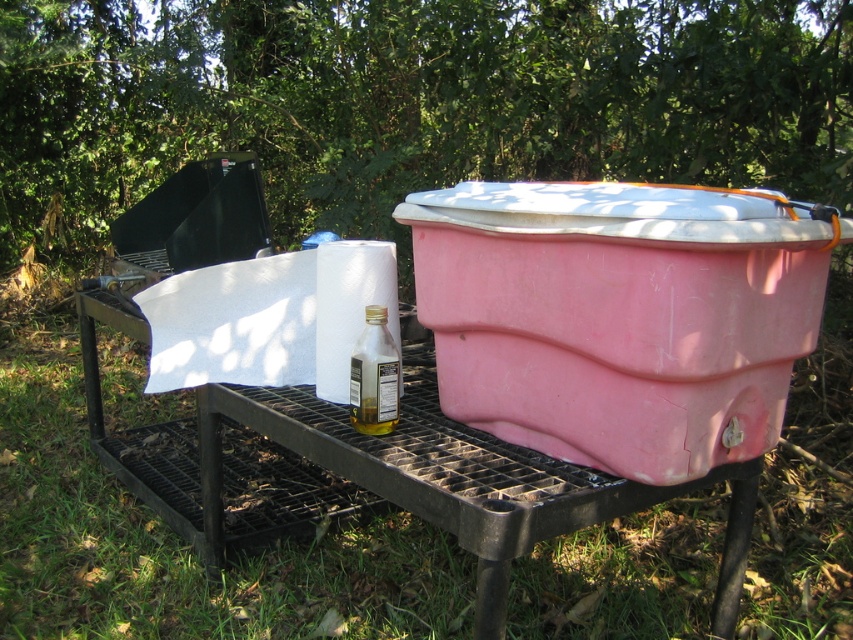
Question: Can you confirm if green grass at lower left is smaller than clear glass bottle at center?

Choices:
 (A) yes
 (B) no

Answer: (B)

Question: Is pink plastic cooler at center bigger than clear glass bottle at center?

Choices:
 (A) yes
 (B) no

Answer: (A)

Question: Is green grass at lower left above clear glass bottle at center?

Choices:
 (A) yes
 (B) no

Answer: (B)

Question: Which point appears farthest from the camera in this image?

Choices:
 (A) (376, 330)
 (B) (538, 282)

Answer: (A)

Question: Which point is closer to the camera?

Choices:
 (A) [602, 419]
 (B) [108, 388]

Answer: (A)

Question: Which is nearer to the pink plastic cooler at center?

Choices:
 (A) clear glass bottle at center
 (B) green grass at lower left

Answer: (A)